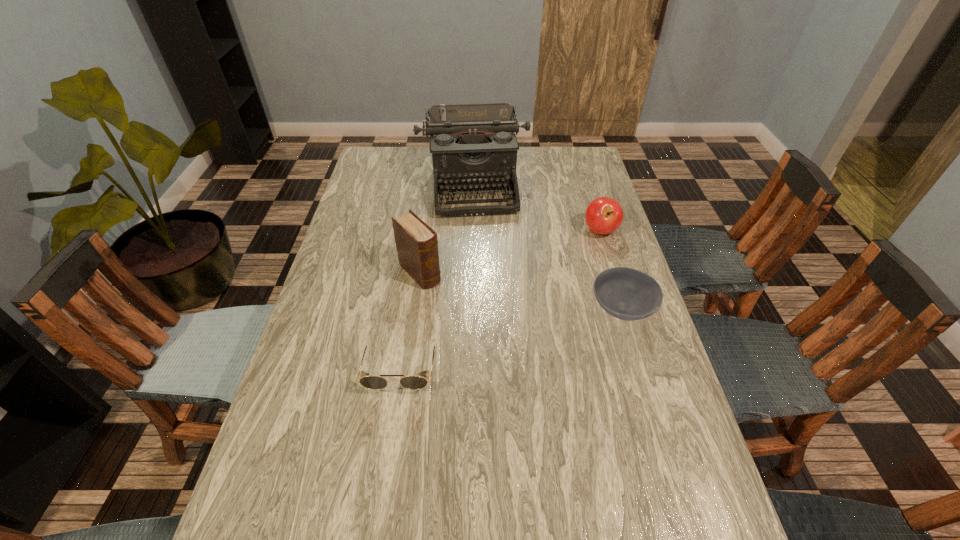
This screenshot has height=540, width=960. Identify the location of vacant area at the left edge. (355, 220).

In the image, there is a desktop. At what (x,y) coordinates should I click in order to perform the action: click on free region at the right edge. Please return your answer as a coordinate pair (x, y). The image size is (960, 540). Looking at the image, I should click on (605, 336).

The height and width of the screenshot is (540, 960). In the image, there is a desktop. What are the coordinates of `vacant space at the far left corner` in the screenshot? It's located at (379, 177).

In the image, there is a desktop. At what (x,y) coordinates should I click in order to perform the action: click on vacant area at the far right corner. Please return your answer as a coordinate pair (x, y). This screenshot has height=540, width=960. Looking at the image, I should click on (591, 178).

Locate an element on the screen. Image resolution: width=960 pixels, height=540 pixels. free space at the near right corner of the desktop is located at coordinates (658, 501).

In order to click on unoccupied position between the third shortest object and the diary in this screenshot , I will do `click(510, 252)`.

At what (x,y) coordinates should I click in order to perform the action: click on free spot between the nearest object and the diary. Please return your answer as a coordinate pair (x, y). Image resolution: width=960 pixels, height=540 pixels. Looking at the image, I should click on (410, 321).

Where is `unoccupied position between the diary and the third shortest object`? The width and height of the screenshot is (960, 540). unoccupied position between the diary and the third shortest object is located at coordinates (510, 252).

Locate an element on the screen. vacant space that's between the bowl and the sunglasses is located at coordinates (512, 339).

Find the location of a particular element. Image resolution: width=960 pixels, height=540 pixels. free spot between the bowl and the diary is located at coordinates (521, 291).